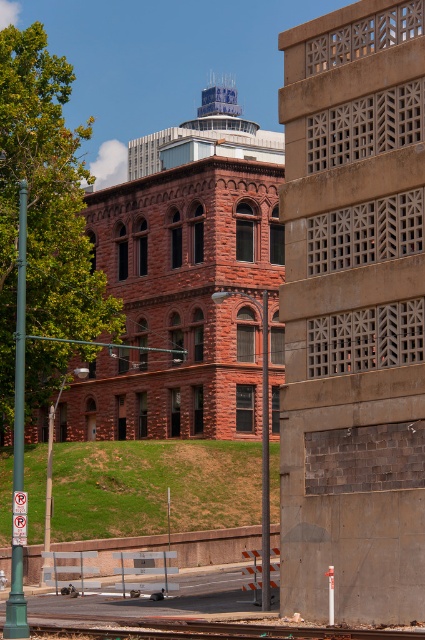
You are standing at the lower center of the image and want to walk towards the brown textured wall at center right. Do you need to step over the smooth concrete train track at lower center?

The brown textured wall at center right is positioned over the smooth concrete train track at lower center, so you would need to step over the smooth concrete train track at lower center to reach the wall.

You are standing at the edge of the train track and want to walk towards the wall. Which direction should you move relative to the smooth concrete train track at lower center to reach the brown textured wall at center right?

To reach the brown textured wall at center right from the smooth concrete train track at lower center, you should move to the right since the wall is positioned to the right of the track.